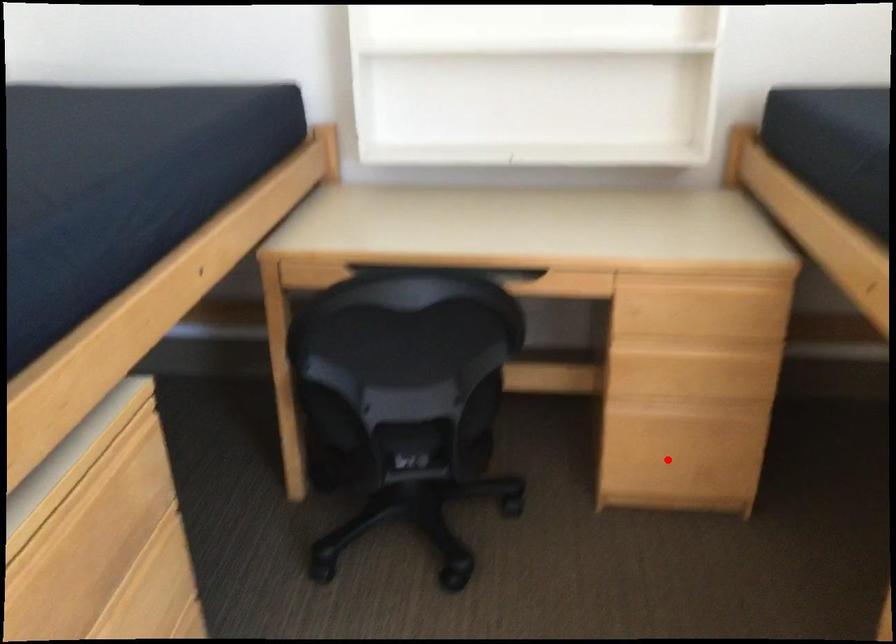
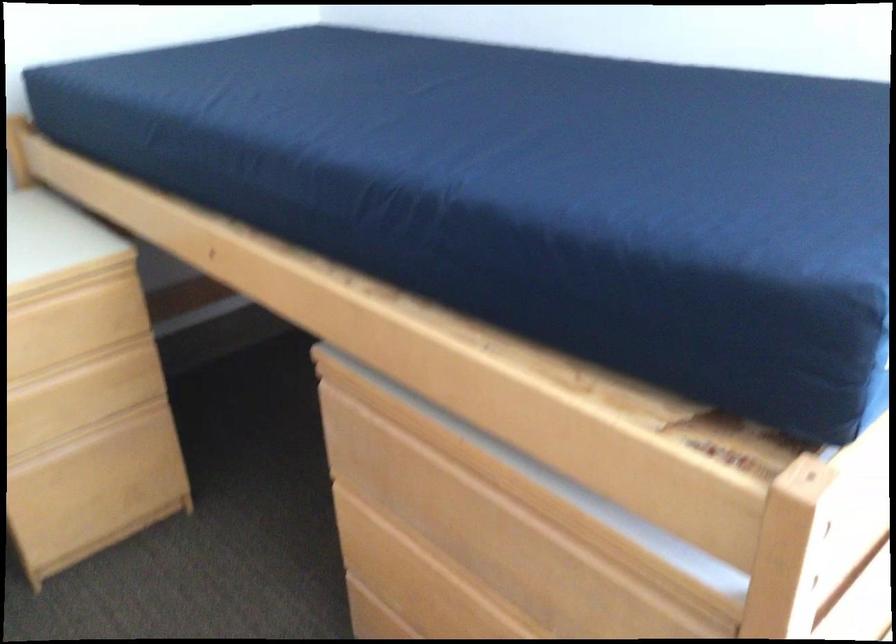
Where in the second image is the point corresponding to the highlighted location from the first image?

(97, 495)